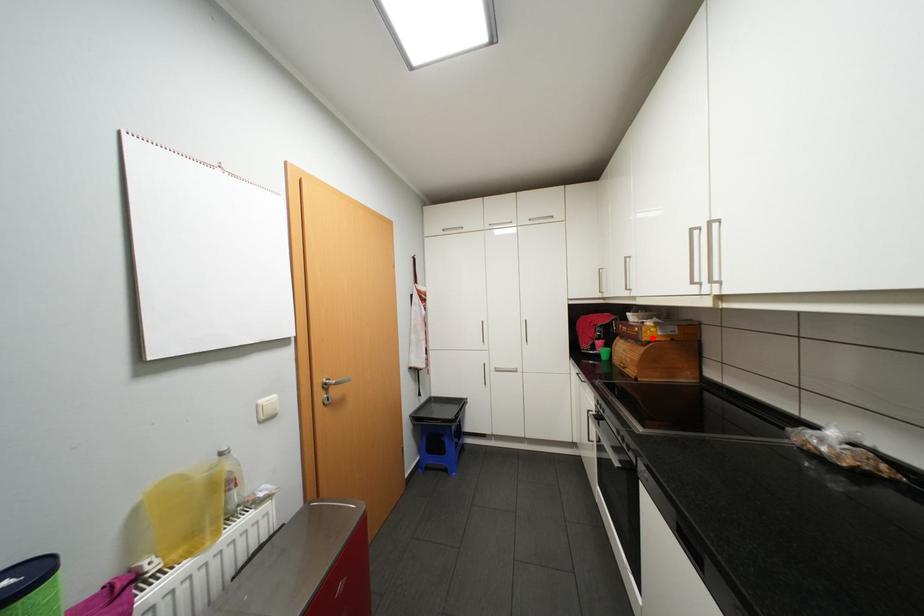
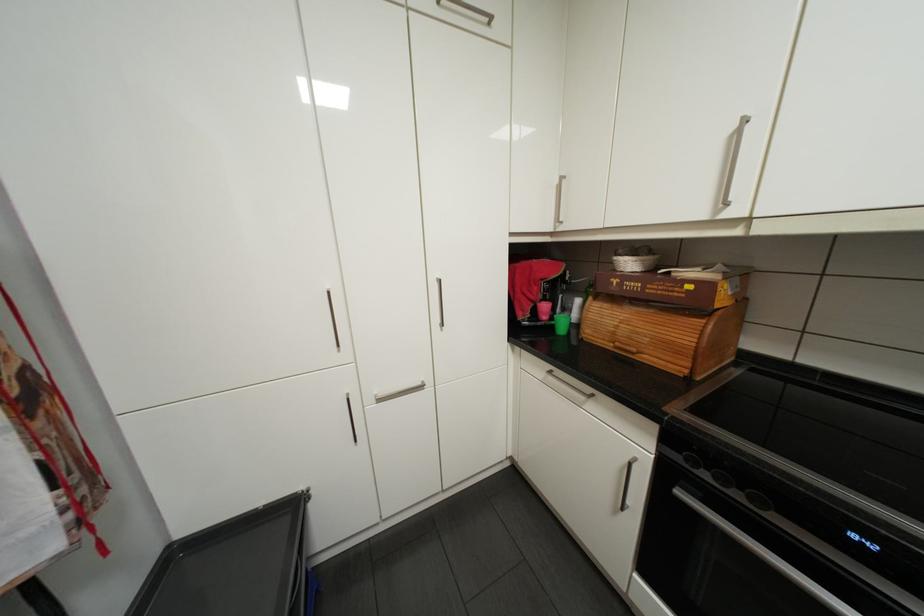
The point at the highlighted location is marked in the first image. Where is the corresponding point in the second image?

(725, 305)